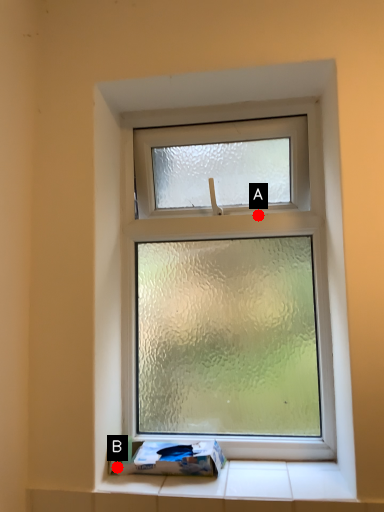
Question: Two points are circled on the image, labeled by A and B beside each circle. Which point is farther to the camera?

Choices:
 (A) A is further
 (B) B is further

Answer: (A)